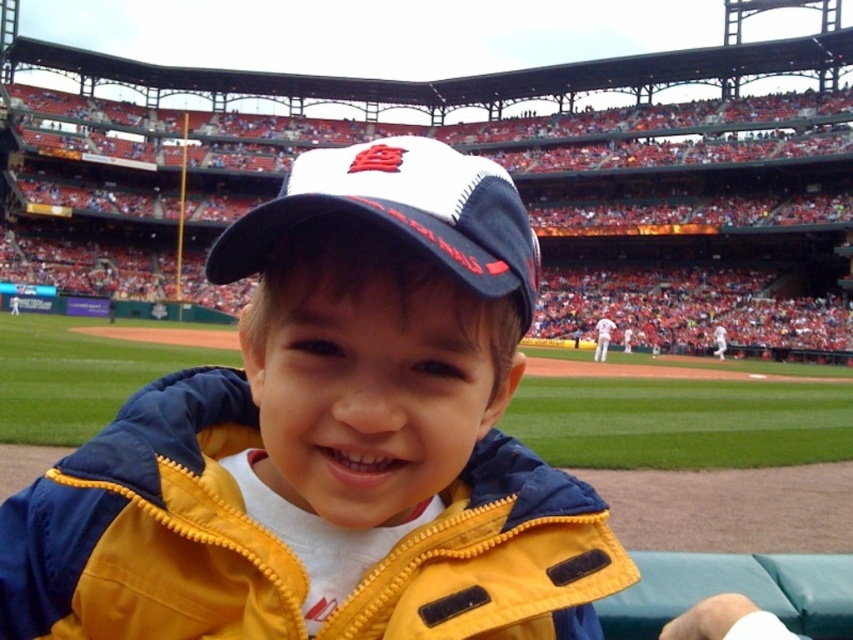
Does yellow quilted jacket at center have a lesser width compared to white mesh cap at center?

Yes.

The width and height of the screenshot is (853, 640). What do you see at coordinates (331, 440) in the screenshot?
I see `yellow quilted jacket at center` at bounding box center [331, 440].

Identify the location of yellow quilted jacket at center. point(331,440).